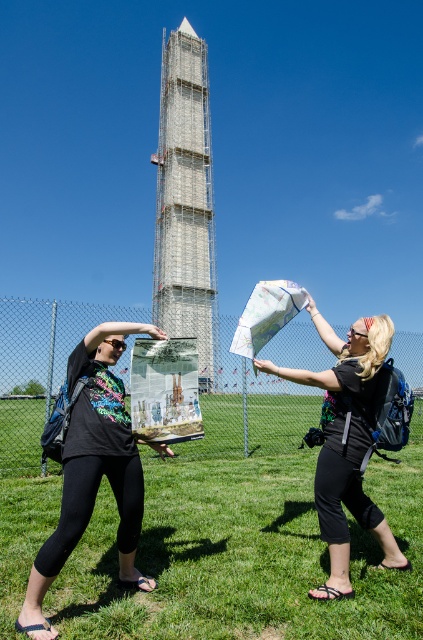
Is scaffolding metal tower at center thinner than black matte backpack at center?

No, scaffolding metal tower at center is not thinner than black matte backpack at center.

Is scaffolding metal tower at center behind black matte backpack at center?

Yes, it is behind black matte backpack at center.

Between point (176, 45) and point (338, 484), which one is positioned behind?

Positioned behind is point (176, 45).

This screenshot has width=423, height=640. I want to click on scaffolding metal tower at center, so click(x=186, y=202).

Which is above, black fabric pants at lower center or black matte backpack at center?

black matte backpack at center is higher up.

Who is positioned more to the left, black fabric pants at lower center or black matte backpack at center?

black fabric pants at lower center is more to the left.

The width and height of the screenshot is (423, 640). What are the coordinates of `black fabric pants at lower center` in the screenshot? It's located at (244, 541).

What do you see at coordinates (244, 541) in the screenshot?
I see `black fabric pants at lower center` at bounding box center [244, 541].

Is point (368, 538) less distant than point (214, 278)?

Yes, it is.

Where is `black fabric pants at lower center`? The width and height of the screenshot is (423, 640). black fabric pants at lower center is located at coordinates (244, 541).